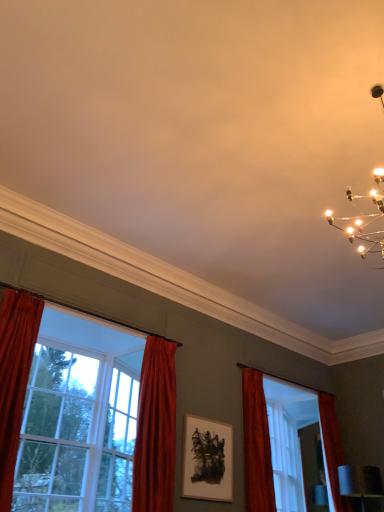
What are the coordinates of `clear glass window at left, which is the 2th window in right-to-left order` in the screenshot? It's located at pos(80,411).

The height and width of the screenshot is (512, 384). Describe the element at coordinates (207, 460) in the screenshot. I see `wooden picture frame at center` at that location.

At what (x,y) coordinates should I click in order to perform the action: click on velvet red curtain at right, the 1th curtain viewed from the right. Please return your answer as a coordinate pair (x, y). Looking at the image, I should click on (256, 445).

Identify the location of clear glass window at left, the 2th window positioned from the left. This screenshot has width=384, height=512. (80, 411).

Based on the photo, considering the relative sizes of wooden picture frame at center and velvet red curtain at center, acting as the 2th curtain starting from the right, in the image provided, is wooden picture frame at center wider than velvet red curtain at center, acting as the 2th curtain starting from the right,?

Incorrect, the width of wooden picture frame at center does not surpass that of velvet red curtain at center, acting as the 2th curtain starting from the right.

In the scene shown: From the image's perspective, relative to velvet red curtain at center, acting as the 2th curtain starting from the right, is wooden picture frame at center above or below?

From the image's perspective, wooden picture frame at center appears below velvet red curtain at center, acting as the 2th curtain starting from the right.

Could you tell me if velvet red curtain at right, the 2th curtain in the left-to-right sequence, is turned towards clear glass window at left, positioned as the 1th window in left-to-right order?

No, velvet red curtain at right, the 2th curtain in the left-to-right sequence, is not facing towards clear glass window at left, positioned as the 1th window in left-to-right order.

Considering the sizes of objects velvet red curtain at right, the 2th curtain in the left-to-right sequence, and clear glass window at left, positioned as the 1th window in left-to-right order, in the image provided, who is taller, velvet red curtain at right, the 2th curtain in the left-to-right sequence, or clear glass window at left, positioned as the 1th window in left-to-right order,?

clear glass window at left, positioned as the 1th window in left-to-right order, is taller.

Is point (246, 468) positioned before point (64, 508)?

That is False.

Does velvet red curtain at center, the first curtain positioned from the left, have a lesser height compared to clear glass window at left, the 2th window positioned from the left?

In fact, velvet red curtain at center, the first curtain positioned from the left, may be taller than clear glass window at left, the 2th window positioned from the left.

From a real-world perspective, which is physically above, velvet red curtain at center, the first curtain positioned from the left, or clear glass window at left, the 2th window positioned from the left?

velvet red curtain at center, the first curtain positioned from the left.

Between velvet red curtain at center, the first curtain positioned from the left, and clear glass window at left, the 2th window positioned from the left, which one has larger size?

clear glass window at left, the 2th window positioned from the left, is bigger.

Which point is more forward, [168,440] or [92,466]?

Point [168,440]

Based on the photo, is velvet red curtain at right, the 1th curtain viewed from the right, in front of or behind velvet red curtain at center, the first curtain positioned from the left, in the image?

Visually, velvet red curtain at right, the 1th curtain viewed from the right, is located behind velvet red curtain at center, the first curtain positioned from the left.

How many degrees apart are the facing directions of velvet red curtain at right, the 1th curtain viewed from the right, and velvet red curtain at center, the first curtain positioned from the left?

0.363 degrees.

Is velvet red curtain at right, the 2th curtain in the left-to-right sequence, at the left side of velvet red curtain at center, acting as the 2th curtain starting from the right?

Incorrect, velvet red curtain at right, the 2th curtain in the left-to-right sequence, is not on the left side of velvet red curtain at center, acting as the 2th curtain starting from the right.

Considering the relative sizes of velvet red curtain at right, the 2th curtain in the left-to-right sequence, and velvet red curtain at center, acting as the 2th curtain starting from the right, in the image provided, is velvet red curtain at right, the 2th curtain in the left-to-right sequence, taller than velvet red curtain at center, acting as the 2th curtain starting from the right,?

No, velvet red curtain at right, the 2th curtain in the left-to-right sequence, is not taller than velvet red curtain at center, acting as the 2th curtain starting from the right.

Measure the distance between clear glass window at left, the third window viewed from the right, and wooden picture frame at center.

clear glass window at left, the third window viewed from the right, and wooden picture frame at center are 1.25 meters apart from each other.

Based on their sizes in the image, would you say clear glass window at left, the third window viewed from the right, is bigger or smaller than wooden picture frame at center?

clear glass window at left, the third window viewed from the right, is bigger than wooden picture frame at center.

From the image's perspective, which is above, clear glass window at left, positioned as the 1th window in left-to-right order, or wooden picture frame at center?

clear glass window at left, positioned as the 1th window in left-to-right order, is shown above in the image.

Is clear glass window at left, positioned as the 1th window in left-to-right order, touching wooden picture frame at center?

clear glass window at left, positioned as the 1th window in left-to-right order, and wooden picture frame at center are not in contact.

Considering the sizes of objects clear glass window at left, the third window viewed from the right, and velvet red curtain at center, acting as the 2th curtain starting from the right, in the image provided, who is thinner, clear glass window at left, the third window viewed from the right, or velvet red curtain at center, acting as the 2th curtain starting from the right,?

velvet red curtain at center, acting as the 2th curtain starting from the right, is thinner.

Who is bigger, clear glass window at left, positioned as the 1th window in left-to-right order, or velvet red curtain at center, the first curtain positioned from the left?

clear glass window at left, positioned as the 1th window in left-to-right order, is bigger.

Does point (96, 373) come closer to viewer compared to point (165, 383)?

No, (96, 373) is behind (165, 383).

Considering the relative sizes of clear glass window at left, the third window viewed from the right, and velvet red curtain at center, the first curtain positioned from the left, in the image provided, is clear glass window at left, the third window viewed from the right, taller than velvet red curtain at center, the first curtain positioned from the left,?

Indeed, clear glass window at left, the third window viewed from the right, has a greater height compared to velvet red curtain at center, the first curtain positioned from the left.

From the picture: Is velvet red curtain at right, the 2th curtain in the left-to-right sequence, surrounded by matte red curtain at center, arranged as the first window when viewed from the right?

No.

How different are the orientations of matte red curtain at center, marked as the third window in a left-to-right arrangement, and velvet red curtain at right, the 2th curtain in the left-to-right sequence, in degrees?

There is a 0.692-degree angle between the facing directions of matte red curtain at center, marked as the third window in a left-to-right arrangement, and velvet red curtain at right, the 2th curtain in the left-to-right sequence.

Considering the relative sizes of matte red curtain at center, arranged as the first window when viewed from the right, and velvet red curtain at right, the 2th curtain in the left-to-right sequence, in the image provided, is matte red curtain at center, arranged as the first window when viewed from the right, shorter than velvet red curtain at right, the 2th curtain in the left-to-right sequence,?

Yes.

Is matte red curtain at center, marked as the third window in a left-to-right arrangement, far from velvet red curtain at right, the 1th curtain viewed from the right?

No, matte red curtain at center, marked as the third window in a left-to-right arrangement, is in close proximity to velvet red curtain at right, the 1th curtain viewed from the right.

Locate an element on the screen. The height and width of the screenshot is (512, 384). curtain that is the 1st object above the wooden picture frame at center (from a real-world perspective) is located at coordinates (155, 429).

Image resolution: width=384 pixels, height=512 pixels. I want to click on the 2nd window positioned above the velvet red curtain at right, the 2th curtain in the left-to-right sequence (from the image's perspective), so click(57, 431).

From the image, which object appears to be farther from wooden picture frame at center, clear glass window at left, the 2th window positioned from the left, or velvet red curtain at center, the first curtain positioned from the left?

clear glass window at left, the 2th window positioned from the left.

Looking at the image, which one is located further to clear glass window at left, positioned as the 1th window in left-to-right order, velvet red curtain at right, the 1th curtain viewed from the right, or matte red curtain at center, marked as the third window in a left-to-right arrangement?

matte red curtain at center, marked as the third window in a left-to-right arrangement.

Looking at the image, which one is located further to clear glass window at left, the 2th window positioned from the left, velvet red curtain at right, the 2th curtain in the left-to-right sequence, or matte red curtain at center, marked as the third window in a left-to-right arrangement?

matte red curtain at center, marked as the third window in a left-to-right arrangement, is positioned further to the anchor clear glass window at left, the 2th window positioned from the left.

Based on their spatial positions, is clear glass window at left, which is the 2th window in right-to-left order, or wooden picture frame at center closer to velvet red curtain at right, the 1th curtain viewed from the right?

wooden picture frame at center is positioned closer to the anchor velvet red curtain at right, the 1th curtain viewed from the right.

From the image, which object appears to be nearer to velvet red curtain at right, the 1th curtain viewed from the right, matte red curtain at center, arranged as the first window when viewed from the right, or clear glass window at left, the 2th window positioned from the left?

matte red curtain at center, arranged as the first window when viewed from the right.

Which object lies nearer to the anchor point velvet red curtain at center, the first curtain positioned from the left, clear glass window at left, positioned as the 1th window in left-to-right order, or wooden picture frame at center?

Among the two, wooden picture frame at center is located nearer to velvet red curtain at center, the first curtain positioned from the left.

Looking at the image, which one is located closer to matte red curtain at center, marked as the third window in a left-to-right arrangement, clear glass window at left, positioned as the 1th window in left-to-right order, or wooden picture frame at center?

Among the two, wooden picture frame at center is located nearer to matte red curtain at center, marked as the third window in a left-to-right arrangement.

Considering their positions, is clear glass window at left, positioned as the 1th window in left-to-right order, positioned further to wooden picture frame at center than matte red curtain at center, marked as the third window in a left-to-right arrangement?

The object further to wooden picture frame at center is clear glass window at left, positioned as the 1th window in left-to-right order.

You are a GUI agent. You are given a task and a screenshot of the screen. Output one action in this format:
    pyautogui.click(x=<x>, y=<y>)
    Task: Click on the picture frame situated between velvet red curtain at center, the first curtain positioned from the left, and matte red curtain at center, marked as the third window in a left-to-right arrangement, from left to right
    Image resolution: width=384 pixels, height=512 pixels.
    Given the screenshot: What is the action you would take?
    pyautogui.click(x=207, y=460)

The height and width of the screenshot is (512, 384). What are the coordinates of `curtain between clear glass window at left, the 2th window positioned from the left, and velvet red curtain at right, the 1th curtain viewed from the right` in the screenshot? It's located at (155, 429).

In order to click on curtain located between clear glass window at left, the third window viewed from the right, and wooden picture frame at center in the left-right direction in this screenshot , I will do `click(155, 429)`.

Locate an element on the screen. The image size is (384, 512). picture frame between clear glass window at left, the third window viewed from the right, and matte red curtain at center, marked as the third window in a left-to-right arrangement is located at coordinates (207, 460).